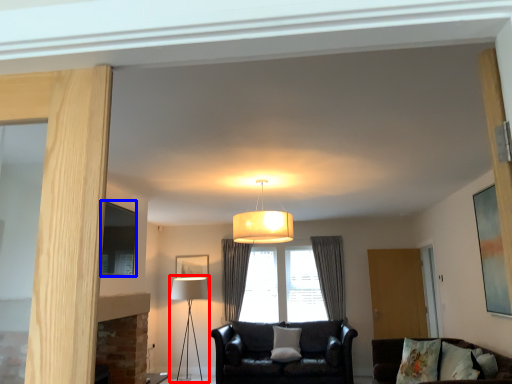
Question: Which object is closer to the camera taking this photo, table lamp (highlighted by a red box) or picture frame (highlighted by a blue box)?

Choices:
 (A) table lamp
 (B) picture frame

Answer: (B)